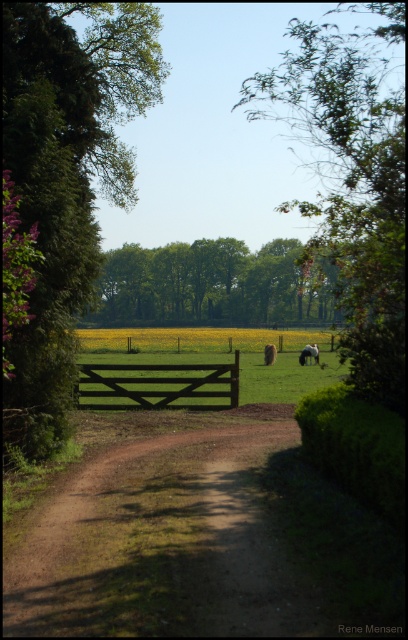
You are standing at the entrance of the wooden gate and want to locate the green leafy tree at upper center. According to the coordinates provided, where should you look relative to your position?

The green leafy tree at upper center is located at coordinates point (352, 182), which means it is positioned to the left and slightly above your current viewpoint.

You are a hiker who wants to take a photo of the black wooden gate at center without the green leafy tree at upper center blocking the view. What should you do?

The green leafy tree at upper center is positioned over the black wooden gate at center. To avoid the tree blocking the view, you should move to a position where the tree is no longer above the gate in your camera frame, such as moving to the side or adjusting your angle.